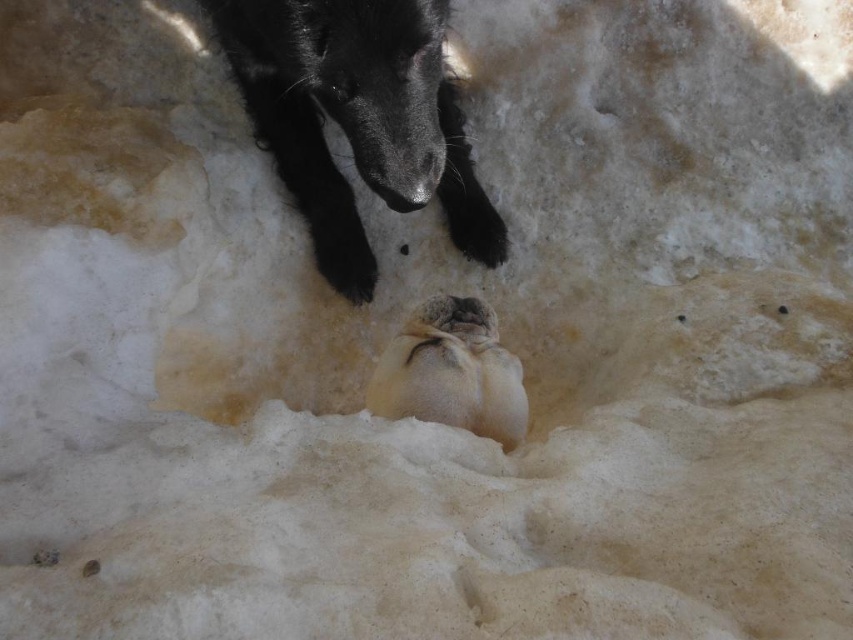
Is black fur animal at upper center to the right of fuzzy white seal at center from the viewer's perspective?

No, black fur animal at upper center is not to the right of fuzzy white seal at center.

Find the location of a particular element. The width and height of the screenshot is (853, 640). black fur animal at upper center is located at coordinates (357, 120).